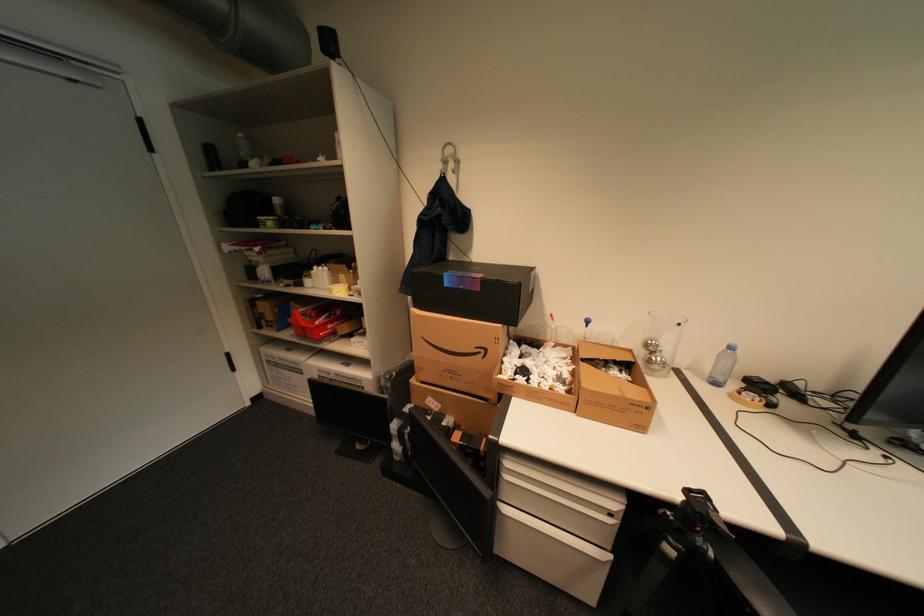
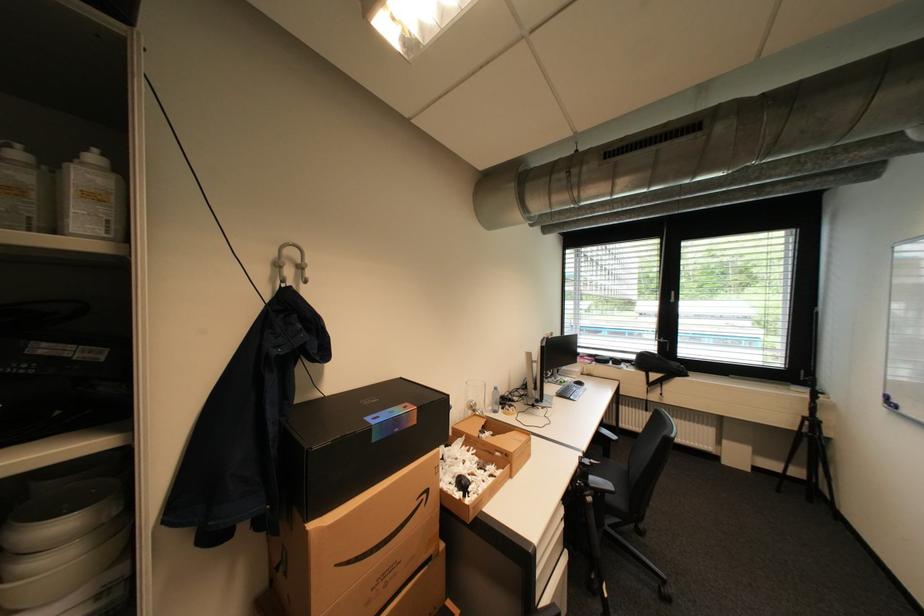
Locate, in the second image, the point that corresponds to (660,341) in the first image.

(480, 402)